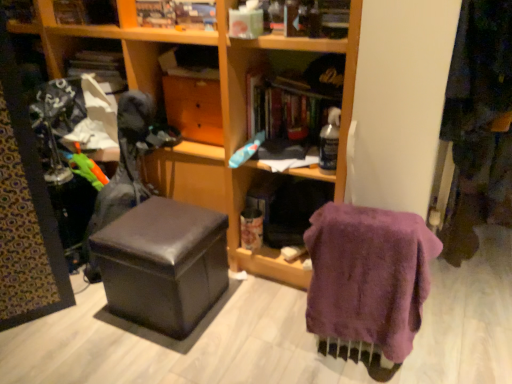
Question: Is hardcover book at center, acting as the first book starting from the right, wider than wooden drawer at center?

Choices:
 (A) yes
 (B) no

Answer: (A)

Question: Considering the relative positions of hardcover book at center, acting as the first book starting from the right, and wooden drawer at center in the image provided, is hardcover book at center, acting as the first book starting from the right, to the right of wooden drawer at center from the viewer's perspective?

Choices:
 (A) no
 (B) yes

Answer: (B)

Question: Would you say hardcover book at center, the fourth book in the left-to-right sequence, is outside wooden drawer at center?

Choices:
 (A) yes
 (B) no

Answer: (A)

Question: From the image's perspective, is hardcover book at center, acting as the first book starting from the right, below wooden drawer at center?

Choices:
 (A) yes
 (B) no

Answer: (A)

Question: From the image's perspective, is hardcover book at center, the fourth book in the left-to-right sequence, on wooden drawer at center?

Choices:
 (A) yes
 (B) no

Answer: (B)

Question: Do you think purple fuzzy towel at lower right is within matte cardboard book at upper center, which is the 2th book from right to left, or outside of it?

Choices:
 (A) inside
 (B) outside

Answer: (B)

Question: Is purple fuzzy towel at lower right bigger or smaller than matte cardboard book at upper center, the 3th book in the left-to-right sequence?

Choices:
 (A) small
 (B) big

Answer: (B)

Question: Is purple fuzzy towel at lower right wider or thinner than matte cardboard book at upper center, which is the 2th book from right to left?

Choices:
 (A) wide
 (B) thin

Answer: (A)

Question: Does point (330, 324) appear closer or farther from the camera than point (164, 64)?

Choices:
 (A) closer
 (B) farther

Answer: (A)

Question: Does point (87, 14) appear closer or farther from the camera than point (392, 332)?

Choices:
 (A) closer
 (B) farther

Answer: (B)

Question: Considering the positions of matte cardboard book at upper center, the 4th book viewed from the right, and purple fuzzy towel at lower right in the image, is matte cardboard book at upper center, the 4th book viewed from the right, wider or thinner than purple fuzzy towel at lower right?

Choices:
 (A) wide
 (B) thin

Answer: (B)

Question: Considering the positions of matte cardboard book at upper center, arranged as the 1th book when viewed from the left, and purple fuzzy towel at lower right in the image, is matte cardboard book at upper center, arranged as the 1th book when viewed from the left, taller or shorter than purple fuzzy towel at lower right?

Choices:
 (A) short
 (B) tall

Answer: (A)

Question: Relative to purple fuzzy towel at lower right, is matte cardboard book at upper center, the 4th book viewed from the right, in front or behind?

Choices:
 (A) behind
 (B) front

Answer: (A)

Question: Would you say purple fuzzy towel at lower right is inside or outside wooden drawer at center?

Choices:
 (A) outside
 (B) inside

Answer: (A)

Question: Is point (408, 233) positioned closer to the camera than point (167, 112)?

Choices:
 (A) farther
 (B) closer

Answer: (B)